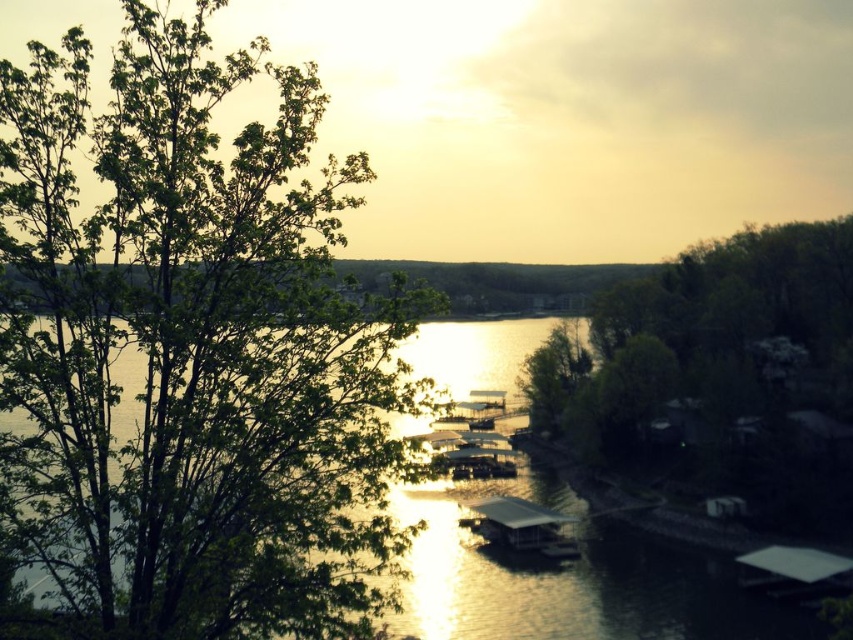
Question: Can you confirm if green leafy tree at center is smaller than white wood dock at center?

Choices:
 (A) no
 (B) yes

Answer: (A)

Question: Which is farther from the white wood dock at center?

Choices:
 (A) green leafy tree at left
 (B) green leafy tree at center

Answer: (A)

Question: Among these points, which one is farthest from the camera?

Choices:
 (A) (817, 419)
 (B) (711, 596)

Answer: (A)

Question: Which point is farther to the camera?

Choices:
 (A) green leafy tree at left
 (B) glistening water at center
 (C) white wood dock at center

Answer: (C)

Question: Does green leafy tree at center have a lesser width compared to glistening water at center?

Choices:
 (A) no
 (B) yes

Answer: (B)

Question: Is green leafy tree at left closer to camera compared to green leafy tree at center?

Choices:
 (A) no
 (B) yes

Answer: (B)